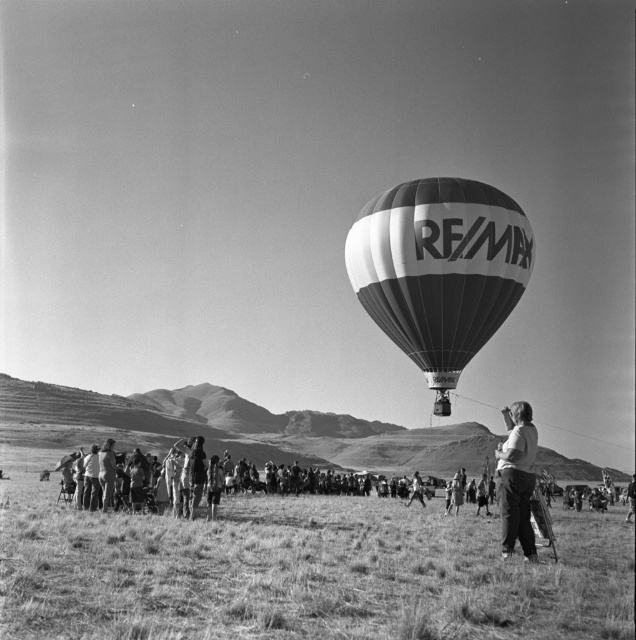
Based on the photo, does white striped balloon at center appear over dark gray pants at right?

Indeed, white striped balloon at center is positioned over dark gray pants at right.

Does white striped balloon at center have a lesser height compared to dark gray pants at right?

No, white striped balloon at center is not shorter than dark gray pants at right.

This screenshot has height=640, width=636. Describe the element at coordinates (439, 268) in the screenshot. I see `white striped balloon at center` at that location.

Locate an element on the screen. This screenshot has height=640, width=636. white striped balloon at center is located at coordinates (439, 268).

Between grassy field at lower center and dark gray pants at right, which one appears on the right side from the viewer's perspective?

dark gray pants at right

What do you see at coordinates (301, 573) in the screenshot? I see `grassy field at lower center` at bounding box center [301, 573].

Identify the location of grassy field at lower center. This screenshot has height=640, width=636. (301, 573).

Does point (258, 616) come behind point (509, 221)?

That is False.

Who is positioned more to the left, grassy field at lower center or white striped balloon at center?

Positioned to the left is grassy field at lower center.

Image resolution: width=636 pixels, height=640 pixels. Identify the location of grassy field at lower center. (301, 573).